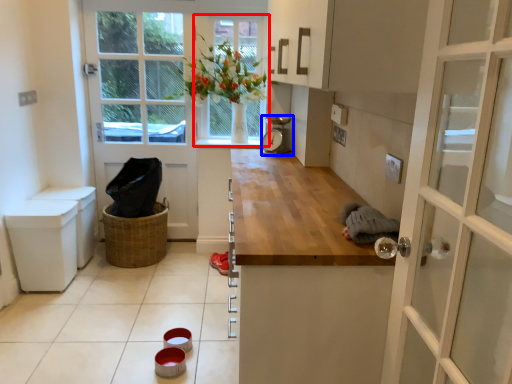
Question: Which object is further to the camera taking this photo, window (highlighted by a red box) or appliance (highlighted by a blue box)?

Choices:
 (A) window
 (B) appliance

Answer: (A)